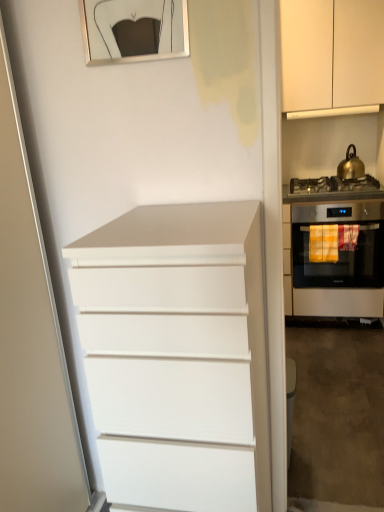
Question: Is white matte chest of drawers at center outside satin silver gas stove at right?

Choices:
 (A) no
 (B) yes

Answer: (B)

Question: Is white matte chest of drawers at center oriented away from satin silver gas stove at right?

Choices:
 (A) no
 (B) yes

Answer: (B)

Question: From the image's perspective, is white matte chest of drawers at center located beneath satin silver gas stove at right?

Choices:
 (A) no
 (B) yes

Answer: (B)

Question: Can you confirm if white matte chest of drawers at center is positioned to the right of satin silver gas stove at right?

Choices:
 (A) yes
 (B) no

Answer: (B)

Question: From the image's perspective, would you say white matte chest of drawers at center is positioned over satin silver gas stove at right?

Choices:
 (A) yes
 (B) no

Answer: (B)

Question: From a real-world perspective, is white matte chest of drawers at center positioned over satin silver gas stove at right based on gravity?

Choices:
 (A) yes
 (B) no

Answer: (B)

Question: Is white matte cabinet at upper right at the left side of white matte chest of drawers at center?

Choices:
 (A) yes
 (B) no

Answer: (B)

Question: From the image's perspective, does white matte cabinet at upper right appear higher than white matte chest of drawers at center?

Choices:
 (A) yes
 (B) no

Answer: (A)

Question: Is white matte cabinet at upper right facing towards white matte chest of drawers at center?

Choices:
 (A) no
 (B) yes

Answer: (B)

Question: Considering the relative sizes of white matte cabinet at upper right and white matte chest of drawers at center in the image provided, is white matte cabinet at upper right shorter than white matte chest of drawers at center?

Choices:
 (A) no
 (B) yes

Answer: (B)

Question: Does white matte cabinet at upper right have a greater width compared to white matte chest of drawers at center?

Choices:
 (A) no
 (B) yes

Answer: (A)

Question: Is white matte cabinet at upper right closer to the viewer compared to white matte chest of drawers at center?

Choices:
 (A) yes
 (B) no

Answer: (B)

Question: Is white matte chest of drawers at center next to metallic gold picture frame at upper center?

Choices:
 (A) no
 (B) yes

Answer: (A)